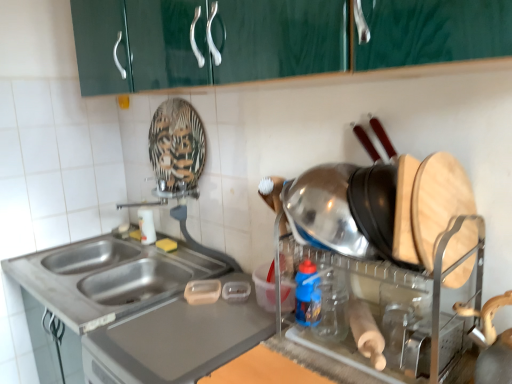
The image size is (512, 384). What do you see at coordinates (388, 254) in the screenshot? I see `shiny metallic pot at right` at bounding box center [388, 254].

Describe the element at coordinates (308, 295) in the screenshot. Image resolution: width=512 pixels, height=384 pixels. I see `blue plastic bottle at center, placed as the first bottle when sorted from right to left` at that location.

At what (x,y) coordinates should I click in order to perform the action: click on shiny metallic pot at right. Please return your answer as a coordinate pair (x, y). Image resolution: width=512 pixels, height=384 pixels. Looking at the image, I should click on (388, 254).

From the image's perspective, is white glossy bottle at sink, acting as the 1th bottle starting from the left, above stainless steel sink at lower left?

Yes.

Between white glossy bottle at sink, which is counted as the 2th bottle, starting from the right, and stainless steel sink at lower left, which one has less height?

stainless steel sink at lower left.

What's the angular difference between white glossy bottle at sink, which appears as the first bottle when viewed from the back, and stainless steel sink at lower left's facing directions?

The angular difference between white glossy bottle at sink, which appears as the first bottle when viewed from the back, and stainless steel sink at lower left is 4.98 degrees.

Is point (148, 238) farther from viewer compared to point (243, 352)?

Yes, it is.

Is shiny metallic pot at right far from white glossy bottle at sink, acting as the 1th bottle starting from the left?

shiny metallic pot at right is positioned a significant distance from white glossy bottle at sink, acting as the 1th bottle starting from the left.

Would you say shiny metallic pot at right is to the left or to the right of white glossy bottle at sink, acting as the 1th bottle starting from the left, in the picture?

From the image, it's evident that shiny metallic pot at right is to the right of white glossy bottle at sink, acting as the 1th bottle starting from the left.

Could you tell me if shiny metallic pot at right is facing white glossy bottle at sink, acting as the 1th bottle starting from the left?

No, shiny metallic pot at right is not turned towards white glossy bottle at sink, acting as the 1th bottle starting from the left.

Is point (340, 238) positioned in front of point (142, 223)?

Yes, point (340, 238) is closer to viewer.

Is blue plastic bottle at center, the second bottle in the left-to-right sequence, with white glossy bottle at sink, arranged as the 2th bottle when viewed from the front?

There is a gap between blue plastic bottle at center, the second bottle in the left-to-right sequence, and white glossy bottle at sink, arranged as the 2th bottle when viewed from the front.

Considering the positions of points (307, 274) and (138, 211), is point (307, 274) closer to camera compared to point (138, 211)?

Yes, point (307, 274) is closer to viewer.

Is blue plastic bottle at center, placed as the first bottle when sorted from right to left, shorter than white glossy bottle at sink, which is counted as the 2th bottle, starting from the right?

Indeed, blue plastic bottle at center, placed as the first bottle when sorted from right to left, has a lesser height compared to white glossy bottle at sink, which is counted as the 2th bottle, starting from the right.

Which is behind, point (120, 355) or point (139, 213)?

The point (139, 213) is more distant.

Is stainless steel sink at lower left located outside white glossy bottle at sink, acting as the 1th bottle starting from the left?

stainless steel sink at lower left lies outside white glossy bottle at sink, acting as the 1th bottle starting from the left,'s area.

Which is more to the left, stainless steel sink at lower left or white glossy bottle at sink, which appears as the first bottle when viewed from the back?

stainless steel sink at lower left is more to the left.

Looking at this image, is stainless steel sink at lower left far away from white glossy bottle at sink, which appears as the first bottle when viewed from the back?

No, there isn't a large distance between stainless steel sink at lower left and white glossy bottle at sink, which appears as the first bottle when viewed from the back.

Can you tell me how much blue plastic bottle at center, positioned as the 2th bottle in back-to-front order, and shiny metallic pot at right differ in facing direction?

The angular difference between blue plastic bottle at center, positioned as the 2th bottle in back-to-front order, and shiny metallic pot at right is 0.199 degrees.

From a real-world perspective, does blue plastic bottle at center, placed as the first bottle when sorted from right to left, stand above shiny metallic pot at right?

No, from a real-world perspective, blue plastic bottle at center, placed as the first bottle when sorted from right to left, is not on top of shiny metallic pot at right.

Is the position of blue plastic bottle at center, the second bottle in the left-to-right sequence, less distant than that of shiny metallic pot at right?

No, it is behind shiny metallic pot at right.

Is blue plastic bottle at center, the second bottle in the left-to-right sequence, surrounding shiny metallic pot at right?

No, shiny metallic pot at right is located outside of blue plastic bottle at center, the second bottle in the left-to-right sequence.

Is shiny metallic pot at right not within blue plastic bottle at center, placed as the first bottle when sorted from right to left?

Absolutely, shiny metallic pot at right is external to blue plastic bottle at center, placed as the first bottle when sorted from right to left.

Considering the relative sizes of shiny metallic pot at right and blue plastic bottle at center, positioned as the 2th bottle in back-to-front order, in the image provided, is shiny metallic pot at right smaller than blue plastic bottle at center, positioned as the 2th bottle in back-to-front order,?

Actually, shiny metallic pot at right might be larger than blue plastic bottle at center, positioned as the 2th bottle in back-to-front order.

Is point (282, 279) closer or farther from the camera than point (310, 321)?

Point (282, 279) appears to be farther away from the viewer than point (310, 321).

Considering the relative sizes of shiny metallic pot at right and blue plastic bottle at center, positioned as the 2th bottle in back-to-front order, in the image provided, is shiny metallic pot at right taller than blue plastic bottle at center, positioned as the 2th bottle in back-to-front order,?

Yes.

Which of these two, blue plastic bottle at center, placed as the first bottle when sorted from right to left, or stainless steel sink at lower left, is wider?

With larger width is stainless steel sink at lower left.

Starting from the stainless steel sink at lower left, which bottle is the 2nd one to the right? Please provide its 2D coordinates.

[(308, 295)]

Is blue plastic bottle at center, the second bottle in the left-to-right sequence, taller than stainless steel sink at lower left?

Correct, blue plastic bottle at center, the second bottle in the left-to-right sequence, is much taller as stainless steel sink at lower left.

From a real-world perspective, is blue plastic bottle at center, positioned as the 2th bottle in back-to-front order, above or below stainless steel sink at lower left?

blue plastic bottle at center, positioned as the 2th bottle in back-to-front order, is above stainless steel sink at lower left.

In the image, there is a white glossy bottle at sink, arranged as the 2th bottle when viewed from the front. Find the location of `countertop below it (from the image's perspective)`. countertop below it (from the image's perspective) is located at coordinates (141, 308).

Image resolution: width=512 pixels, height=384 pixels. I want to click on bottle that is the 2nd one below the shiny metallic pot at right (from a real-world perspective), so click(x=146, y=226).

Which object lies further to the anchor point blue plastic bottle at center, positioned as the 2th bottle in back-to-front order, white glossy bottle at sink, arranged as the 2th bottle when viewed from the front, or shiny metallic pot at right?

Among the two, white glossy bottle at sink, arranged as the 2th bottle when viewed from the front, is located further to blue plastic bottle at center, positioned as the 2th bottle in back-to-front order.

From the image, which object appears to be farther from stainless steel sink at lower left, white glossy bottle at sink, which appears as the first bottle when viewed from the back, or blue plastic bottle at center, positioned as the 2th bottle in back-to-front order?

blue plastic bottle at center, positioned as the 2th bottle in back-to-front order, is further to stainless steel sink at lower left.

From the picture: Considering their positions, is white glossy bottle at sink, acting as the 1th bottle starting from the left, positioned closer to stainless steel sink at lower left than shiny metallic pot at right?

white glossy bottle at sink, acting as the 1th bottle starting from the left, is closer to stainless steel sink at lower left.

Based on their spatial positions, is stainless steel sink at lower left or blue plastic bottle at center, placed as the first bottle when sorted from right to left, further from white glossy bottle at sink, which is counted as the 2th bottle, starting from the right?

blue plastic bottle at center, placed as the first bottle when sorted from right to left, lies further to white glossy bottle at sink, which is counted as the 2th bottle, starting from the right, than the other object.

Looking at the image, which one is located closer to white glossy bottle at sink, which appears as the first bottle when viewed from the back, shiny metallic pot at right or stainless steel sink at lower left?

Based on the image, stainless steel sink at lower left appears to be nearer to white glossy bottle at sink, which appears as the first bottle when viewed from the back.

From the image, which object appears to be farther from shiny metallic pot at right, blue plastic bottle at center, placed as the first bottle when sorted from right to left, or stainless steel sink at lower left?

stainless steel sink at lower left lies further to shiny metallic pot at right than the other object.

Based on their spatial positions, is stainless steel sink at lower left or shiny metallic pot at right closer to blue plastic bottle at center, positioned as the 2th bottle in back-to-front order?

shiny metallic pot at right is positioned closer to the anchor blue plastic bottle at center, positioned as the 2th bottle in back-to-front order.

Consider the image. When comparing their distances from white glossy bottle at sink, acting as the 1th bottle starting from the left, does blue plastic bottle at center, placed as the first bottle when sorted from right to left, or shiny metallic pot at right seem closer?

blue plastic bottle at center, placed as the first bottle when sorted from right to left, is closer to white glossy bottle at sink, acting as the 1th bottle starting from the left.

Locate an element on the screen. countertop between blue plastic bottle at center, placed as the first bottle when sorted from right to left, and white glossy bottle at sink, acting as the 1th bottle starting from the left, along the z-axis is located at coordinates coord(141,308).

At what (x,y) coordinates should I click in order to perform the action: click on bottle positioned between shiny metallic pot at right and white glossy bottle at sink, arranged as the 2th bottle when viewed from the front, from near to far. Please return your answer as a coordinate pair (x, y). The image size is (512, 384). Looking at the image, I should click on (308, 295).

Where is `countertop positioned between shiny metallic pot at right and white glossy bottle at sink, acting as the 1th bottle starting from the left, from near to far`? The height and width of the screenshot is (384, 512). countertop positioned between shiny metallic pot at right and white glossy bottle at sink, acting as the 1th bottle starting from the left, from near to far is located at coordinates tap(141, 308).